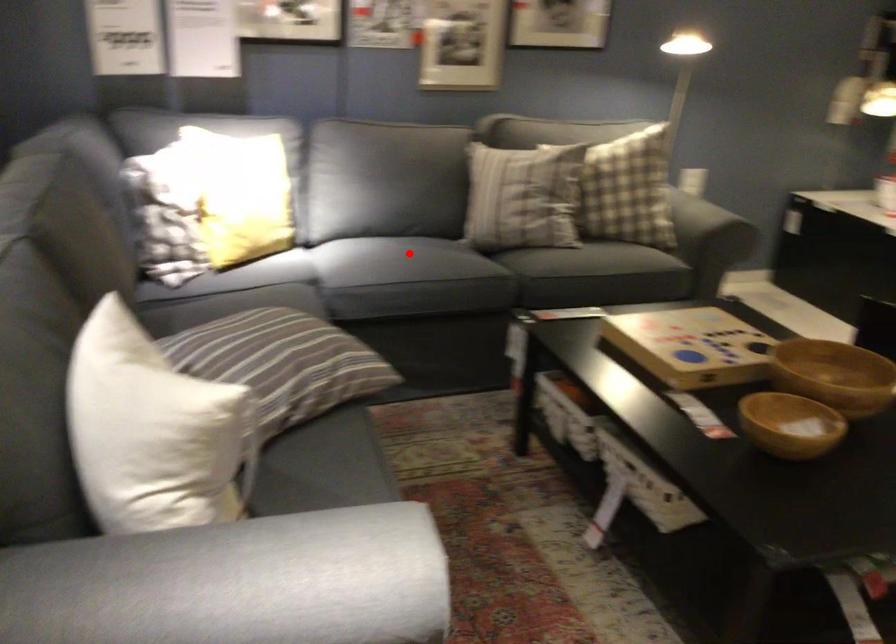
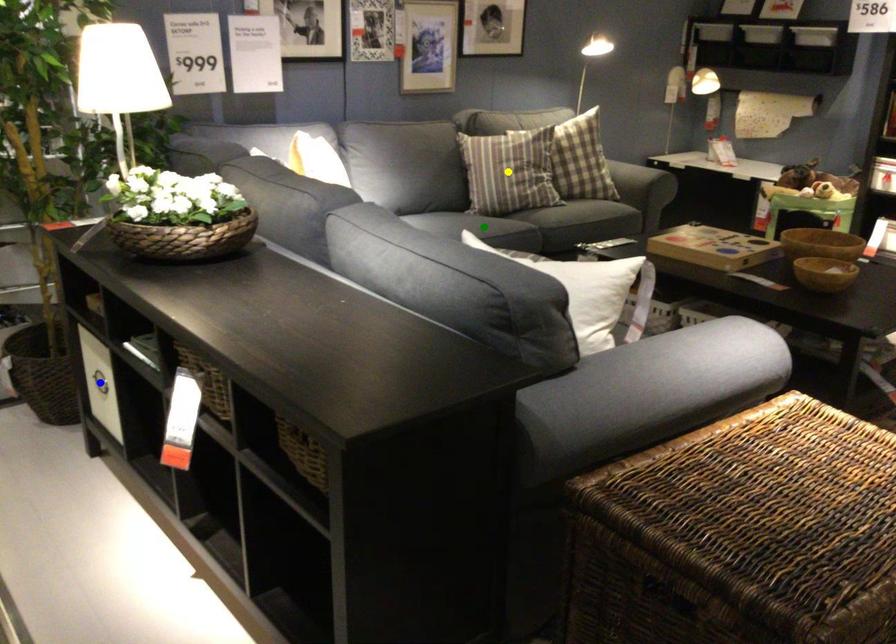
Question: I am providing you with two images of the same scene from different viewpoints. A red point is marked on the first image. You are given multiple points on the second image. In image 2, which mark is for the same physical point as the one in image 1?

Choices:
 (A) green point
 (B) blue point
 (C) yellow point

Answer: (A)